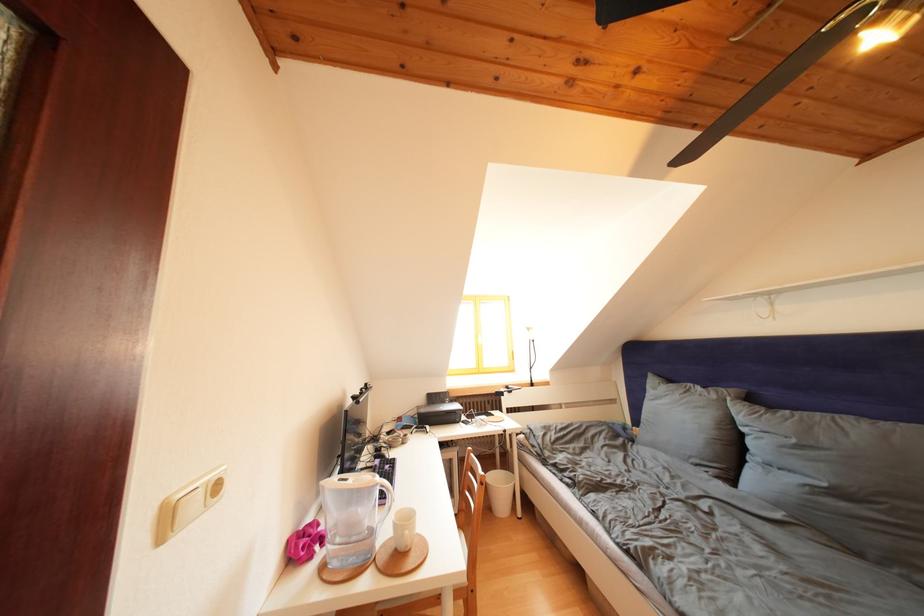
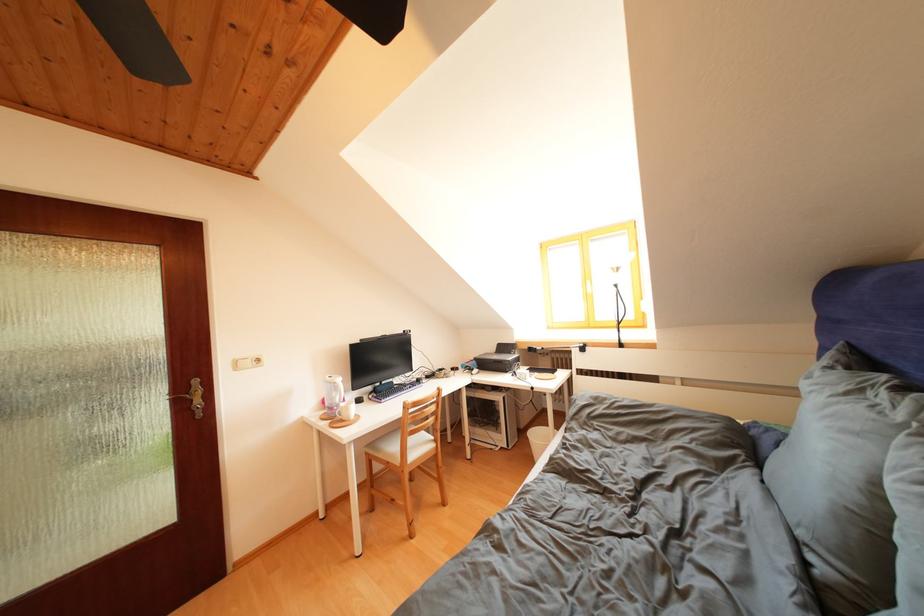
Locate, in the second image, the point that corresponds to (451,407) in the first image.

(517, 358)